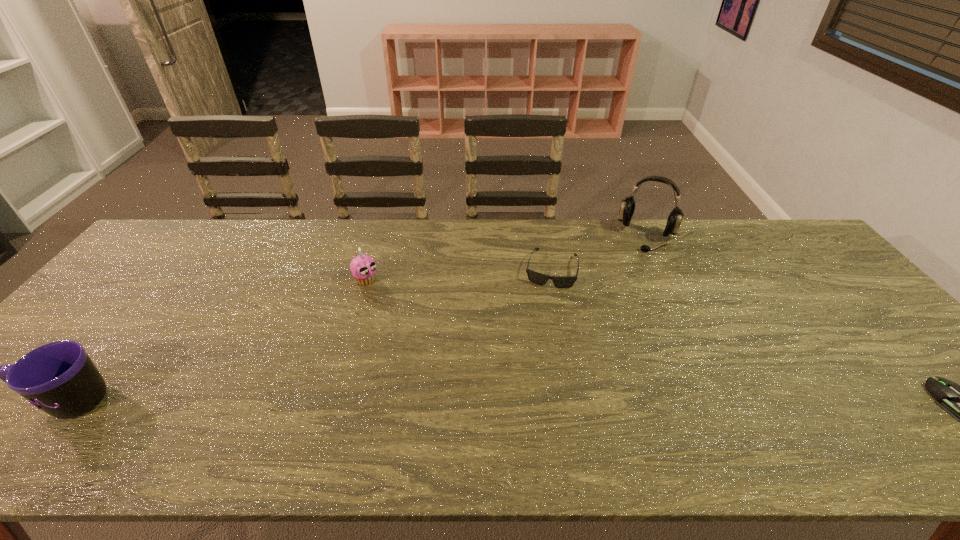
The width and height of the screenshot is (960, 540). Find the location of `the leftmost object`. the leftmost object is located at coordinates (59, 378).

Where is `sunglasses`? This screenshot has width=960, height=540. sunglasses is located at coordinates (538, 278).

Identify the location of the third object from left to right. (538, 278).

Where is `cupcake`? Image resolution: width=960 pixels, height=540 pixels. cupcake is located at coordinates (363, 267).

At what (x,y) coordinates should I click in order to perform the action: click on the fourth object from left to right. Please return your answer as a coordinate pair (x, y). The image size is (960, 540). Looking at the image, I should click on 627,208.

Locate an element on the screen. The height and width of the screenshot is (540, 960). headset is located at coordinates (627, 208).

The height and width of the screenshot is (540, 960). I want to click on free space located on the front-facing side of the sunglasses, so click(x=531, y=370).

The height and width of the screenshot is (540, 960). I want to click on free point located 0.100m on the front-facing side of the sunglasses, so click(542, 313).

This screenshot has width=960, height=540. In order to click on vacant space located on the front-facing side of the sunglasses in this screenshot , I will do `click(531, 370)`.

Find the location of `free spot located 0.290m on the face of the cupcake`. free spot located 0.290m on the face of the cupcake is located at coordinates (440, 339).